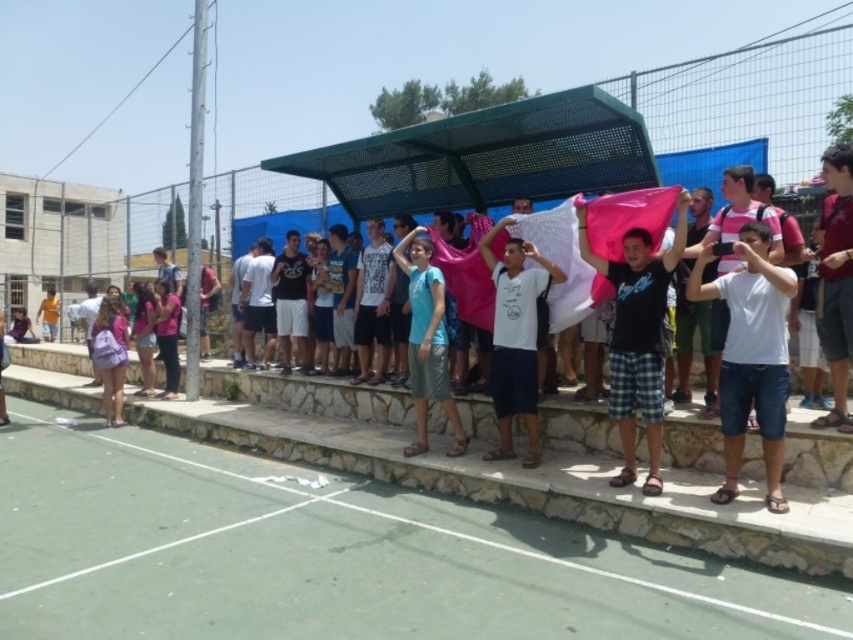
This screenshot has width=853, height=640. Describe the element at coordinates (329, 556) in the screenshot. I see `green rubber court at lower center` at that location.

Is point (117, 548) closer to viewer compared to point (503, 385)?

That is True.

The image size is (853, 640). I want to click on green rubber court at lower center, so click(x=329, y=556).